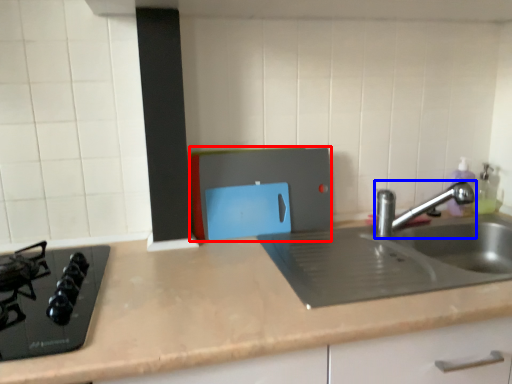
Question: Which object appears farthest to the camera in this image, appliance (highlighted by a red box) or tap (highlighted by a blue box)?

Choices:
 (A) appliance
 (B) tap

Answer: (A)